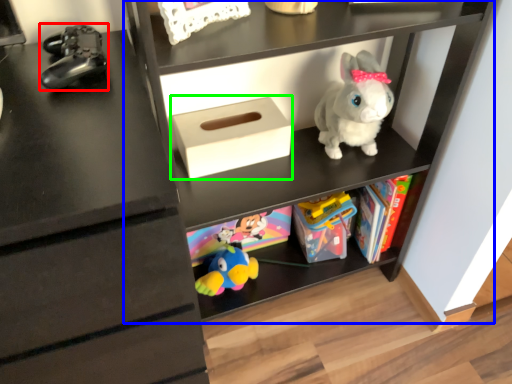
Question: Which object is positioned farthest from toy (highlighted by a red box)? Select from shelf (highlighted by a blue box) and shoe box (highlighted by a green box).

Choices:
 (A) shelf
 (B) shoe box

Answer: (A)